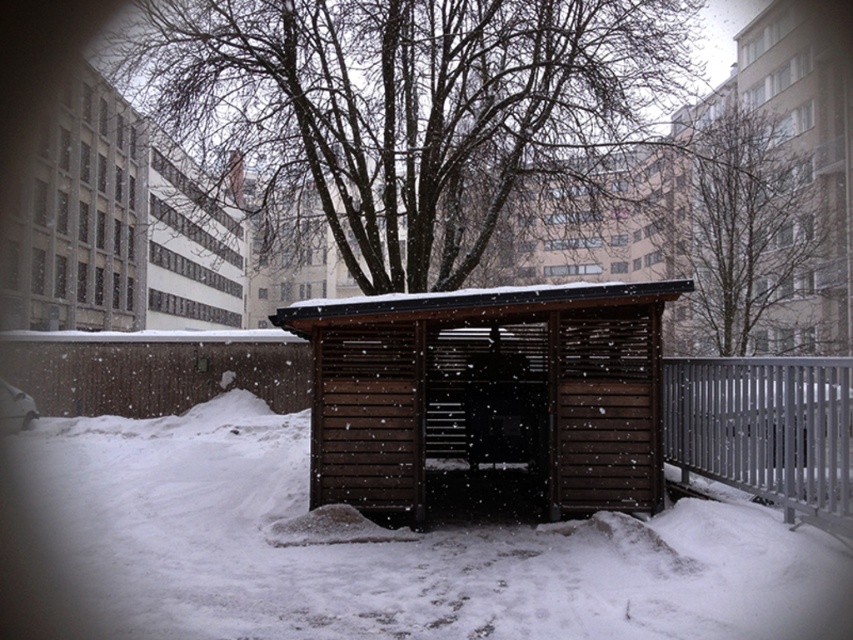
Question: Estimate the real-world distances between objects in this image. Which object is closer to the brown wooden bus stop at center?

Choices:
 (A) brown wooden hut at upper center
 (B) white fluffy snow at center

Answer: (B)

Question: Does brown wooden bus stop at center have a smaller size compared to brown wooden hut at upper center?

Choices:
 (A) no
 (B) yes

Answer: (B)

Question: Which object is positioned farthest from the brown wooden bus stop at center?

Choices:
 (A) bare branches at upper center
 (B) white fluffy snow at center
 (C) brown wooden hut at upper center
 (D) brown wooden hut at left

Answer: (C)

Question: Can you confirm if silver metallic fence at right is bigger than brown wooden hut at upper center?

Choices:
 (A) yes
 (B) no

Answer: (B)

Question: Which point is closer to the camera?

Choices:
 (A) brown wooden hut at left
 (B) brown wooden bus stop at center
 (C) brown textured tree at center

Answer: (B)

Question: Is bare branches at upper center thinner than brown wooden hut at left?

Choices:
 (A) no
 (B) yes

Answer: (A)